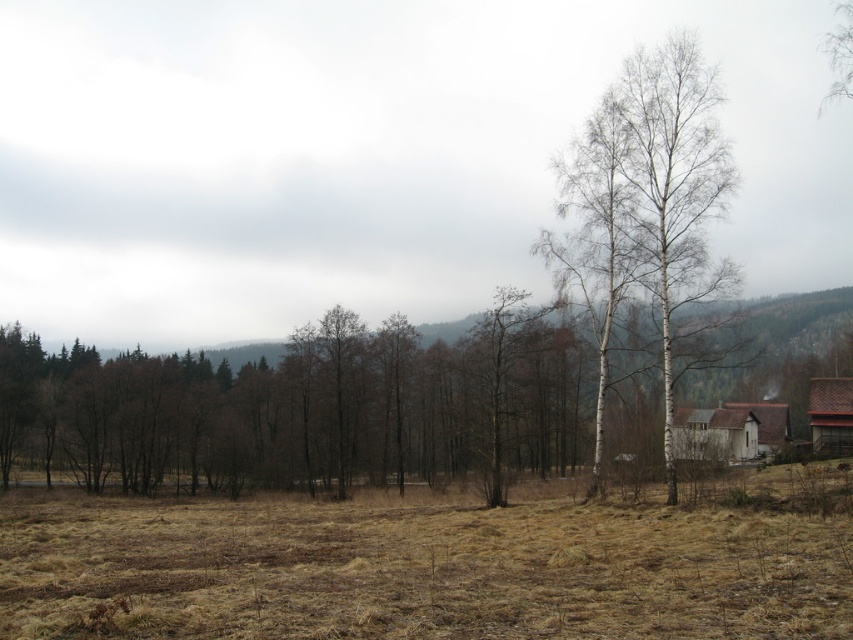
Question: Where is white wooden house at lower right located in relation to brown wooden barn at lower right in the image?

Choices:
 (A) right
 (B) left

Answer: (B)

Question: Among these objects, which one is farthest from the camera?

Choices:
 (A) white bark tree at right
 (B) white wooden house at lower right
 (C) brown grass at center
 (D) brown wooden barn at lower right

Answer: (D)

Question: Which object appears closest to the camera in this image?

Choices:
 (A) brown wooden barn at lower right
 (B) white wooden house at lower right
 (C) brown grass at center

Answer: (C)

Question: Does white bark tree at right appear under white wooden house at lower right?

Choices:
 (A) no
 (B) yes

Answer: (A)

Question: Does white bark tree at right appear under white wooden house at lower right?

Choices:
 (A) yes
 (B) no

Answer: (B)

Question: Which of the following is the farthest from the observer?

Choices:
 (A) (811, 401)
 (B) (207, 520)

Answer: (A)